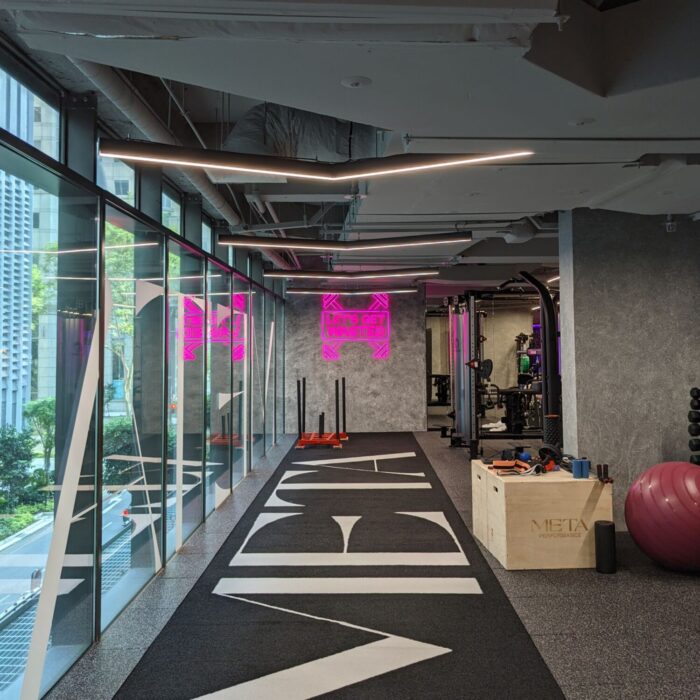
The image size is (700, 700). In order to click on large window panes in this screenshot , I will do `click(46, 426)`, `click(129, 371)`, `click(189, 372)`, `click(220, 365)`, `click(239, 367)`, `click(257, 365)`, `click(269, 368)`, `click(281, 369)`.